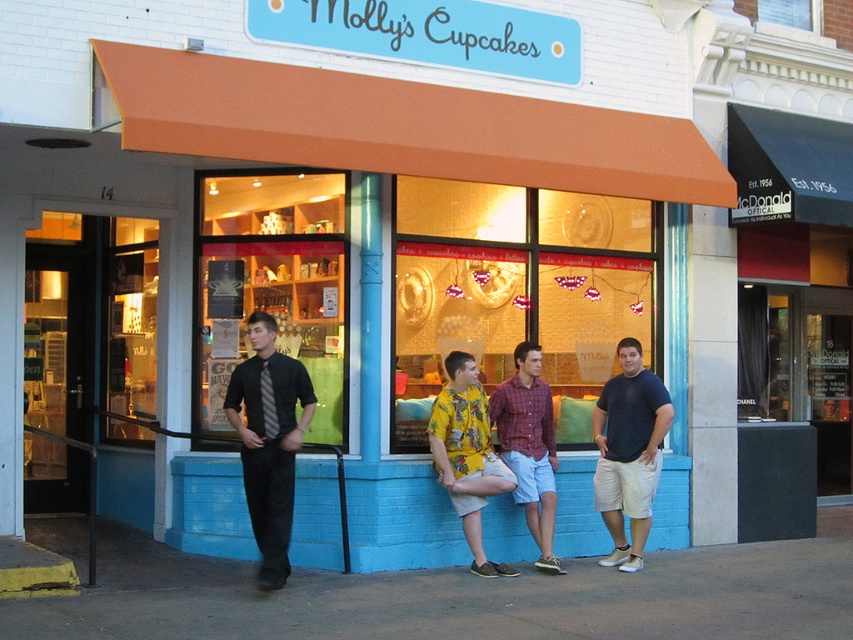
You are trying to decide which shirt to buy for a casual outing. You notice the matte black shirt at left and the plaid cotton shirt at center in the bakery window. Which shirt is taller?

The matte black shirt at left is taller than the plaid cotton shirt at center.

You are trying to decide which shirt to wear for a casual day out. Both the yellow printed shirt at center and the plaid cotton shirt at center are hanging in the bakery window. Based on their appearance in the window, which shirt would you choose if you want something that stands out more?

The yellow printed shirt at center might be wider than the plaid cotton shirt at center, so it could stand out more due to its size.